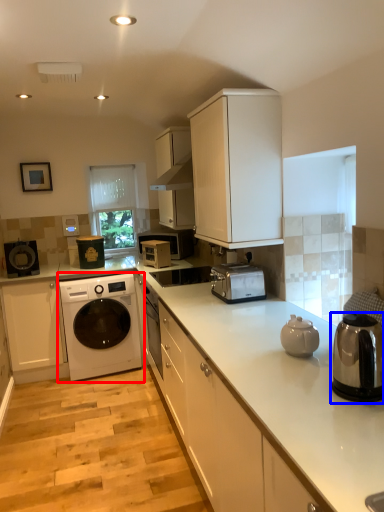
Question: Among these objects, which one is farthest to the camera, washing machine (highlighted by a red box) or home appliance (highlighted by a blue box)?

Choices:
 (A) washing machine
 (B) home appliance

Answer: (A)